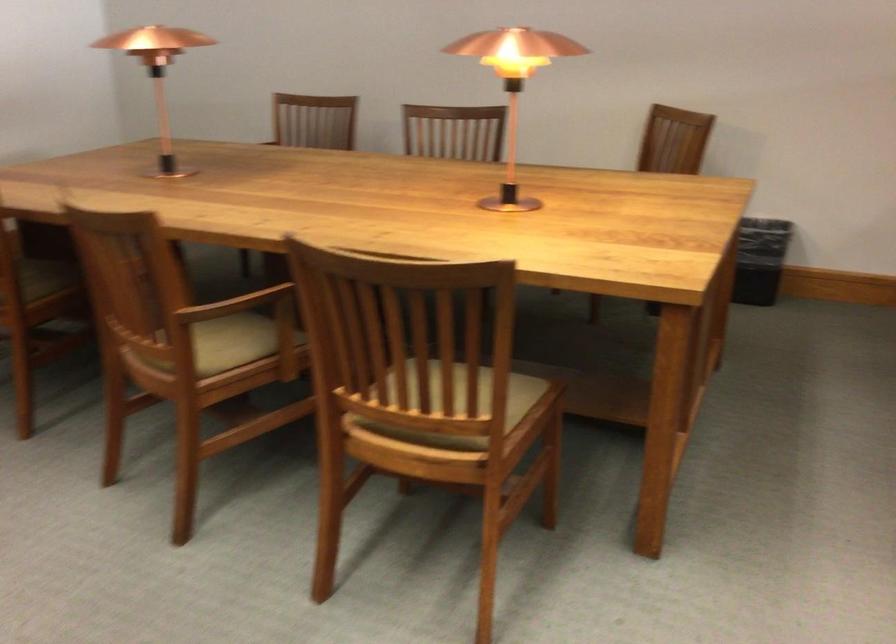
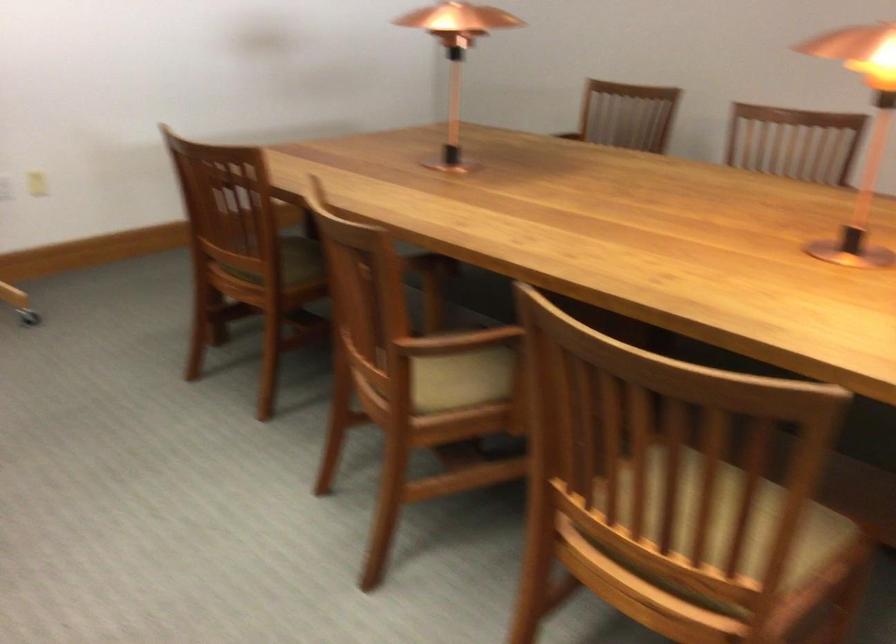
In the second image, find the point that corresponds to point 228,305 in the first image.

(455, 342)